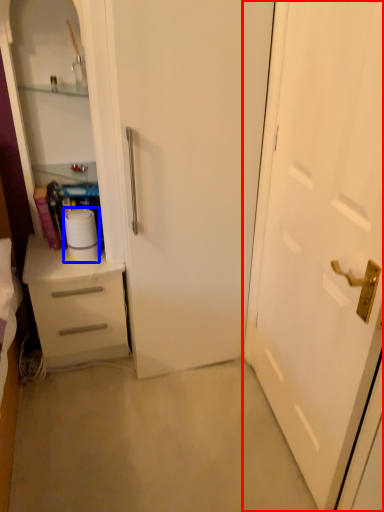
Question: Which of the following is the farthest to the observer, door (highlighted by a red box) or paper towel (highlighted by a blue box)?

Choices:
 (A) door
 (B) paper towel

Answer: (B)